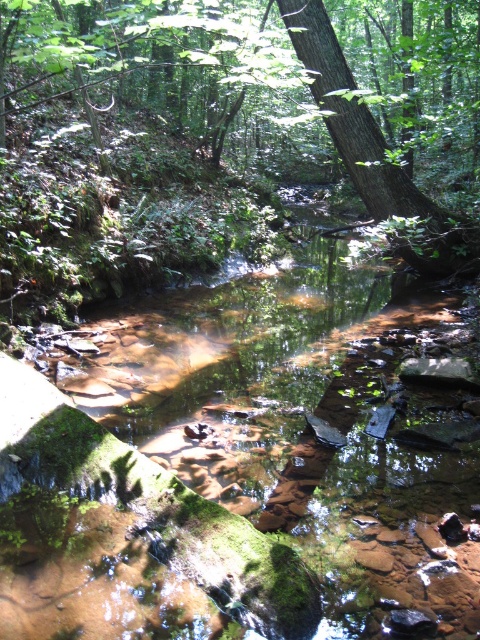
Is point (297, 353) more distant than point (478, 150)?

No, it is not.

Can you confirm if clear water at center is positioned to the left of green leafy tree at center?

In fact, clear water at center is to the right of green leafy tree at center.

Find the location of a particular element. The height and width of the screenshot is (640, 480). clear water at center is located at coordinates [x=303, y=420].

In the scene shown: Is clear water at center behind green rough bark tree at center?

No, clear water at center is closer to the viewer.

Who is more forward, (355, 396) or (399, 246)?

Point (355, 396) is more forward.

Find the location of `clear water at center`. clear water at center is located at coordinates (303, 420).

Between point (159, 68) and point (423, 260), which one is positioned in front?

Point (423, 260)

Who is higher up, green leafy tree at center or green rough bark tree at center?

Positioned higher is green leafy tree at center.

Find the location of a particular element. green leafy tree at center is located at coordinates (277, 84).